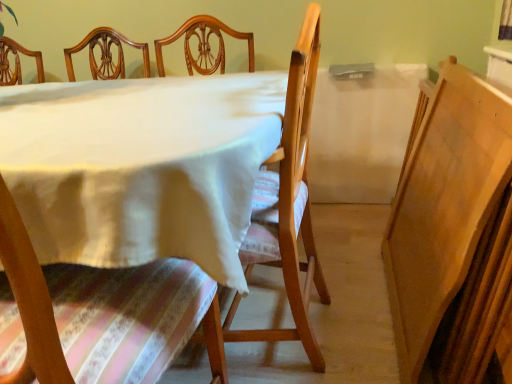
Question: Does wooden chair at center, the 1th chair from the left, have a smaller size compared to white cloth at center?

Choices:
 (A) no
 (B) yes

Answer: (B)

Question: Considering the relative sizes of wooden chair at center, positioned as the second chair in right-to-left order, and white cloth at center in the image provided, is wooden chair at center, positioned as the second chair in right-to-left order, bigger than white cloth at center?

Choices:
 (A) no
 (B) yes

Answer: (A)

Question: From the image's perspective, is wooden chair at center, positioned as the second chair in right-to-left order, below white cloth at center?

Choices:
 (A) no
 (B) yes

Answer: (B)

Question: From the image's perspective, is wooden chair at center, positioned as the second chair in right-to-left order, on white cloth at center?

Choices:
 (A) no
 (B) yes

Answer: (A)

Question: Does wooden chair at center, the 1th chair from the left, lie in front of white cloth at center?

Choices:
 (A) no
 (B) yes

Answer: (B)

Question: Considering the positions of wooden chair at center, positioned as the second chair in right-to-left order, and wooden chair at center, arranged as the 2th chair when viewed from the left, in the image, is wooden chair at center, positioned as the second chair in right-to-left order, taller or shorter than wooden chair at center, arranged as the 2th chair when viewed from the left,?

Choices:
 (A) tall
 (B) short

Answer: (B)

Question: Considering the positions of wooden chair at center, the 1th chair from the left, and wooden chair at center, arranged as the 2th chair when viewed from the left, in the image, is wooden chair at center, the 1th chair from the left, wider or thinner than wooden chair at center, arranged as the 2th chair when viewed from the left,?

Choices:
 (A) wide
 (B) thin

Answer: (A)

Question: Looking at the image, does wooden chair at center, positioned as the second chair in right-to-left order, seem bigger or smaller compared to wooden chair at center, acting as the first chair starting from the right?

Choices:
 (A) big
 (B) small

Answer: (A)

Question: In the image, is wooden chair at center, positioned as the second chair in right-to-left order, on the left side or the right side of wooden chair at center, acting as the first chair starting from the right?

Choices:
 (A) left
 (B) right

Answer: (A)

Question: Considering their positions, is white cloth at center located in front of or behind wooden chair at center, the 1th chair from the left?

Choices:
 (A) behind
 (B) front

Answer: (A)

Question: In the image, is white cloth at center on the left side or the right side of wooden chair at center, the 1th chair from the left?

Choices:
 (A) left
 (B) right

Answer: (A)

Question: Is white cloth at center wider or thinner than wooden chair at center, positioned as the second chair in right-to-left order?

Choices:
 (A) thin
 (B) wide

Answer: (B)

Question: From a real-world perspective, is white cloth at center above or below wooden chair at center, the 1th chair from the left?

Choices:
 (A) above
 (B) below

Answer: (B)

Question: Is wooden chair at center, positioned as the second chair in right-to-left order, situated inside white cloth at center or outside?

Choices:
 (A) outside
 (B) inside

Answer: (B)

Question: From their relative heights in the image, would you say wooden chair at center, the 1th chair from the left, is taller or shorter than white cloth at center?

Choices:
 (A) short
 (B) tall

Answer: (B)